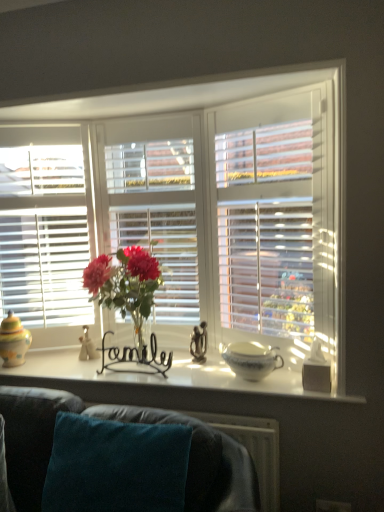
Identify the location of vacant space that is to the left of white ceramic bowl at center. This screenshot has height=512, width=384. (209, 376).